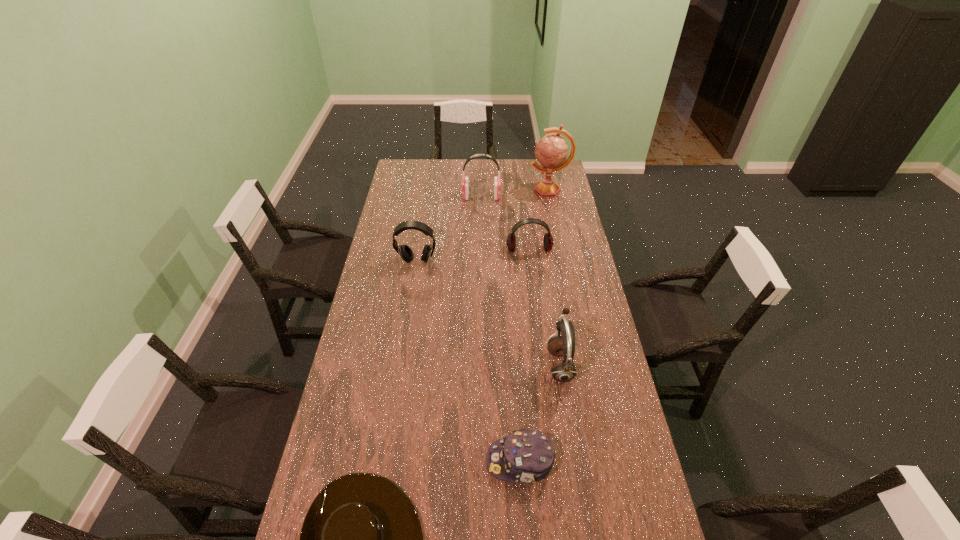
In order to click on vacant space that satisfies the following two spatial constraints: 1. on the ear cups of the shortest earphone; 2. on the front-facing side of the headwear in this screenshot , I will do `click(555, 461)`.

The height and width of the screenshot is (540, 960). In order to click on free space that satisfies the following two spatial constraints: 1. on the front-facing side of the globe; 2. on the ear cups of the leftmost earphone in this screenshot , I will do `click(564, 261)`.